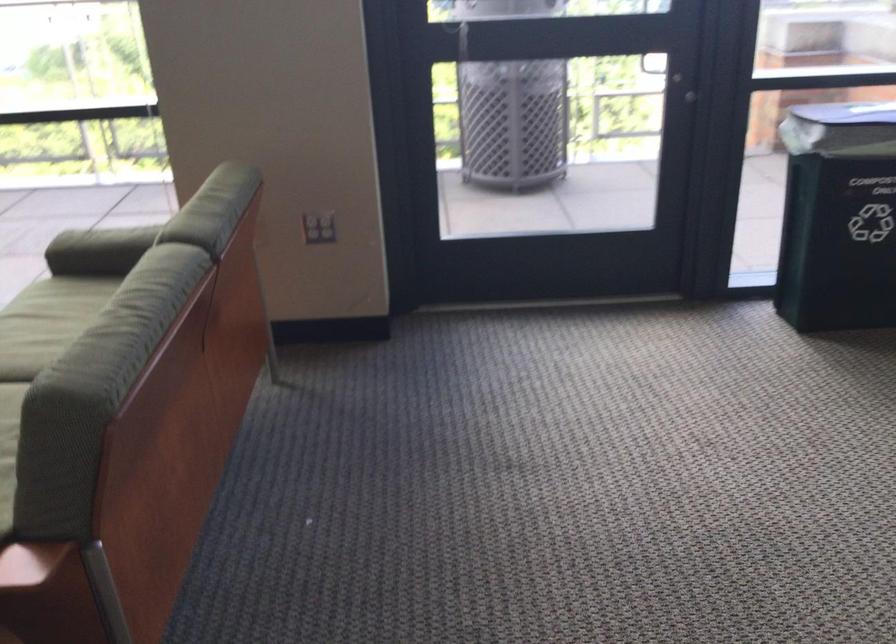
Find where to push the black door handle. Please return your answer as a coordinate pair (x, y).

(691, 98)